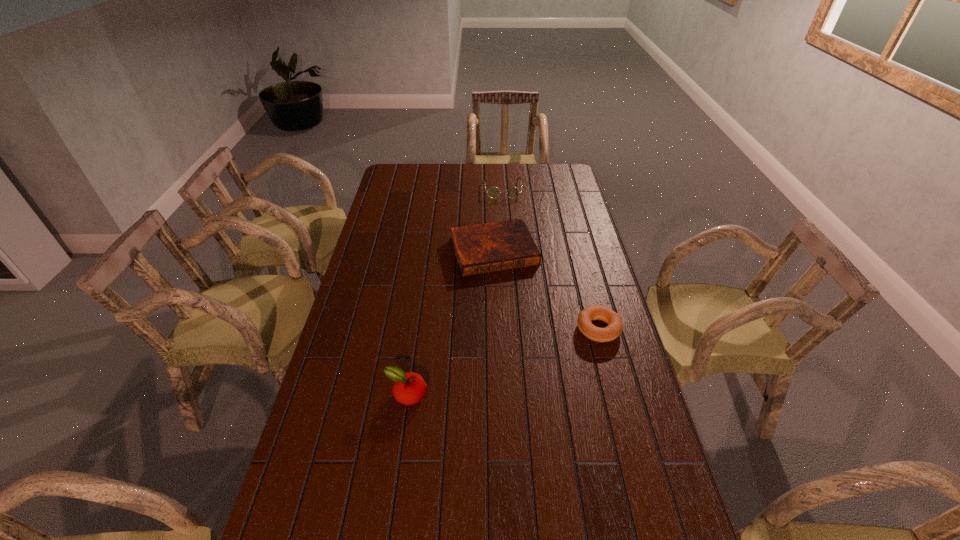
I want to click on unoccupied position between the second nearest object and the third nearest object, so coord(546,289).

Locate an element on the screen. vacant area that lies between the spectacles and the bagel is located at coordinates (551, 259).

Select which object appears as the closest to the third farthest object. Please provide its 2D coordinates. Your answer should be formatted as a tuple, i.e. [(x, y)], where the tuple contains the x and y coordinates of a point satisfying the conditions above.

[(490, 247)]

Locate which object is the second closest to the nearest object. Please provide its 2D coordinates. Your answer should be formatted as a tuple, i.e. [(x, y)], where the tuple contains the x and y coordinates of a point satisfying the conditions above.

[(613, 330)]

Identify the location of free space that satisfies the following two spatial constraints: 1. on the back side of the rightmost object; 2. on the left side of the apple. Image resolution: width=960 pixels, height=540 pixels. (416, 328).